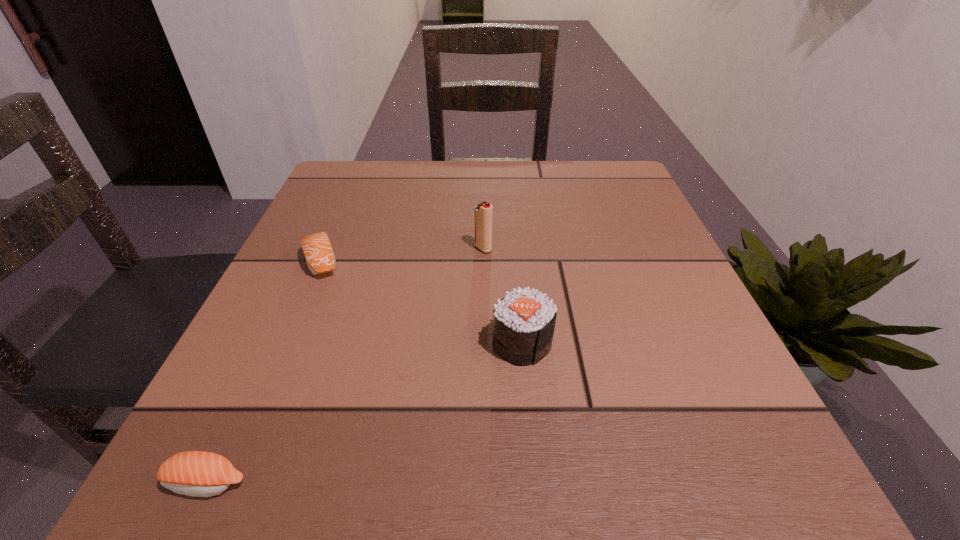
At what (x,y) coordinates should I click in order to perform the action: click on igniter. Please return your answer as a coordinate pair (x, y). Looking at the image, I should click on (483, 212).

Locate an element on the screen. the tallest sushi is located at coordinates (524, 320).

Find the location of a particular element. the third farthest object is located at coordinates tap(524, 320).

At what (x,y) coordinates should I click in order to perform the action: click on the farthest sushi. Please return your answer as a coordinate pair (x, y). The width and height of the screenshot is (960, 540). Looking at the image, I should click on (317, 248).

This screenshot has width=960, height=540. I want to click on the nearest object, so (x=194, y=473).

Find the location of a particular element. vacant region located on the front of the igniter is located at coordinates (484, 301).

I want to click on vacant space located 0.270m on the back of the third farthest object, so click(x=512, y=227).

Locate an element on the screen. blank space located on the front of the farthest sushi is located at coordinates 262,402.

You are a GUI agent. You are given a task and a screenshot of the screen. Output one action in this format:
    pyautogui.click(x=<x>, y=<y>)
    Task: Click on the blank area located 0.130m on the right of the nearest sushi
    
    Given the screenshot: What is the action you would take?
    pyautogui.click(x=358, y=483)

Find the location of `object situated at the near edge`. object situated at the near edge is located at coordinates (194, 473).